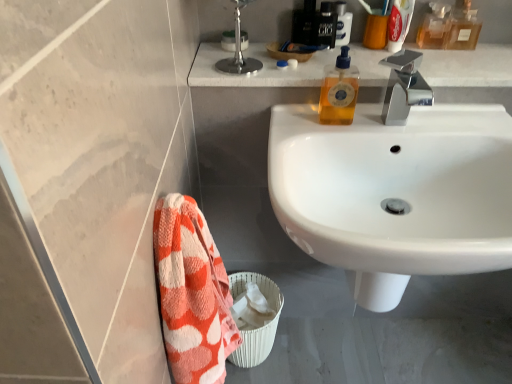
Where is `free point to the right of white plastic toothpaste tube at upper right, the third mouthwash in the right-to-left sequence`? free point to the right of white plastic toothpaste tube at upper right, the third mouthwash in the right-to-left sequence is located at coordinates (457, 54).